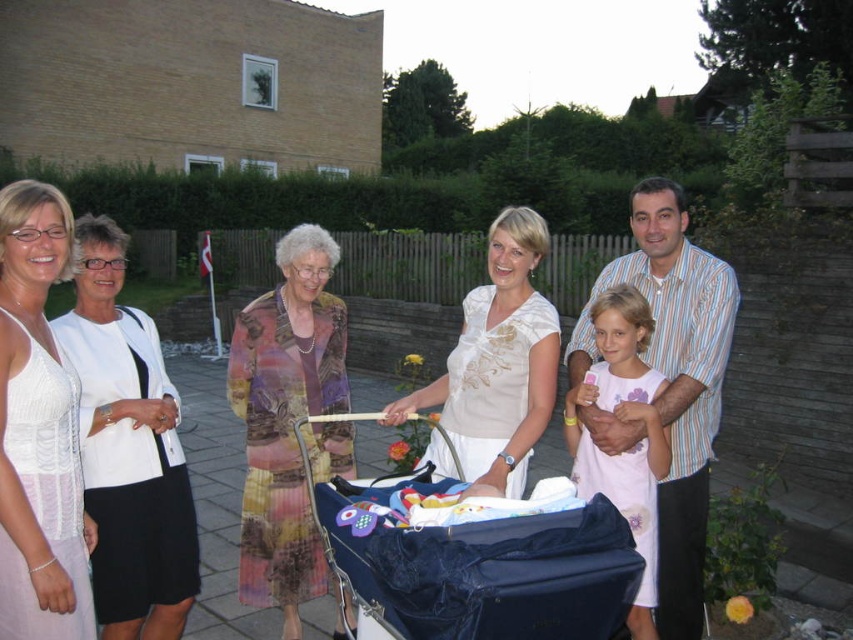
Question: Does white textured blouse at left come behind white embroidered blouse at center?

Choices:
 (A) yes
 (B) no

Answer: (B)

Question: Is blue fabric baby carriage at center in front of white embroidered blouse at center?

Choices:
 (A) yes
 (B) no

Answer: (A)

Question: Among these points, which one is farthest from the camera?

Choices:
 (A) (256, 566)
 (B) (463, 442)
 (C) (601, 561)

Answer: (A)

Question: Which of the following is the closest to the observer?

Choices:
 (A) printed silk dress at center
 (B) white lace dress at left

Answer: (B)

Question: Which point is closer to the camera taking this photo?

Choices:
 (A) (250, 416)
 (B) (33, 250)
 (C) (624, 410)

Answer: (B)

Question: Is blue fabric baby carriage at center above white embroidered blouse at center?

Choices:
 (A) no
 (B) yes

Answer: (A)